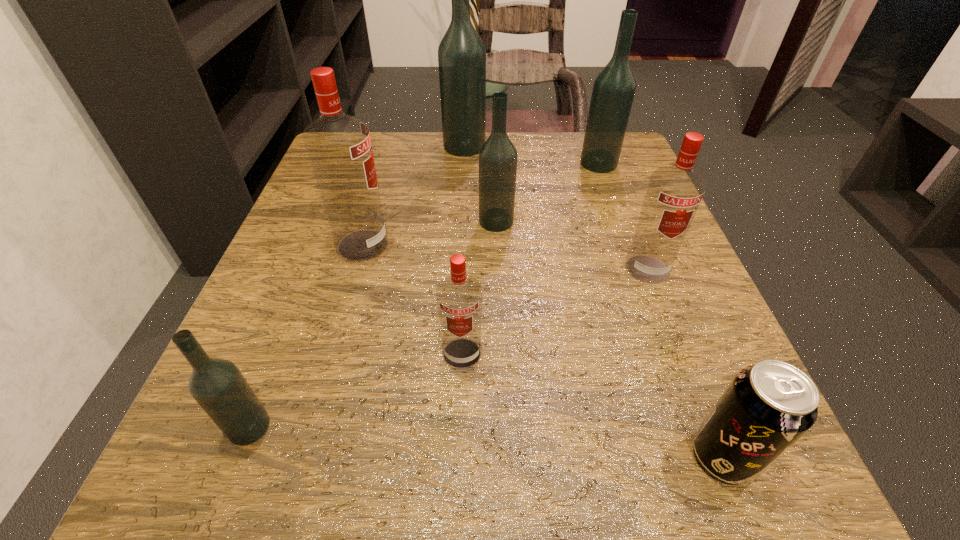
The width and height of the screenshot is (960, 540). What are the coordinates of `vacant region that satisfies the following two spatial constraints: 1. on the back side of the nearest vodka; 2. on the right side of the tallest vodka` in the screenshot? It's located at (359, 146).

Locate an element on the screen. The image size is (960, 540). vacant region that satisfies the following two spatial constraints: 1. on the front label of the nearest red vodka; 2. on the left side of the soda can is located at coordinates (459, 456).

Find the location of `vacant point that satisfies the following two spatial constraints: 1. on the front label of the nearest red vodka; 2. on the right side of the shortest object`. vacant point that satisfies the following two spatial constraints: 1. on the front label of the nearest red vodka; 2. on the right side of the shortest object is located at coordinates (459, 456).